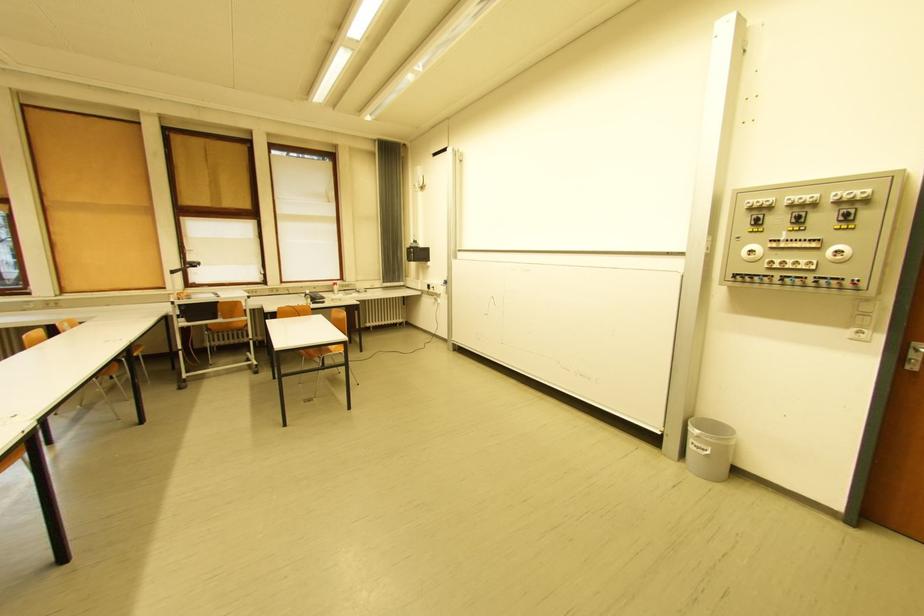
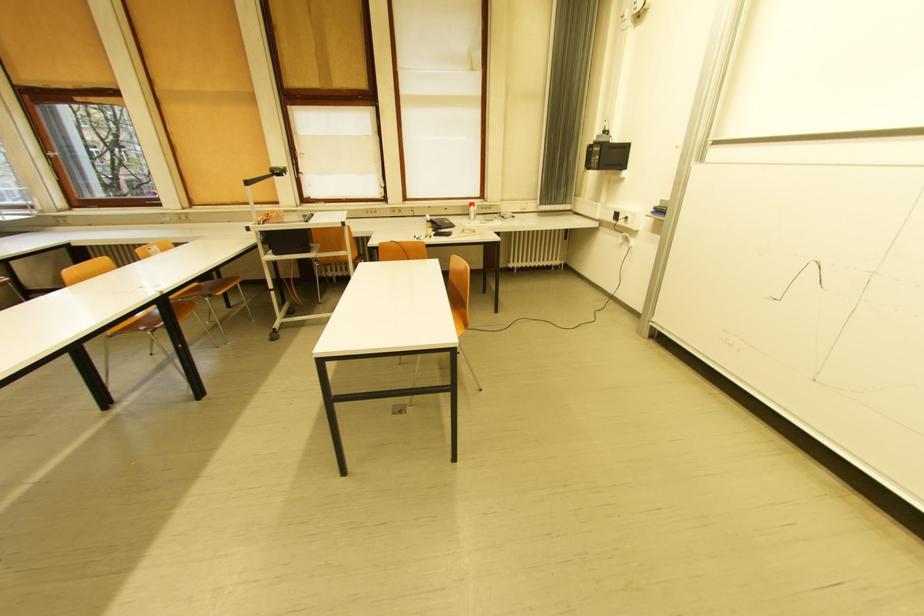
Where in the second image is the point corresponding to the point at 452,283 from the first image?

(662, 209)